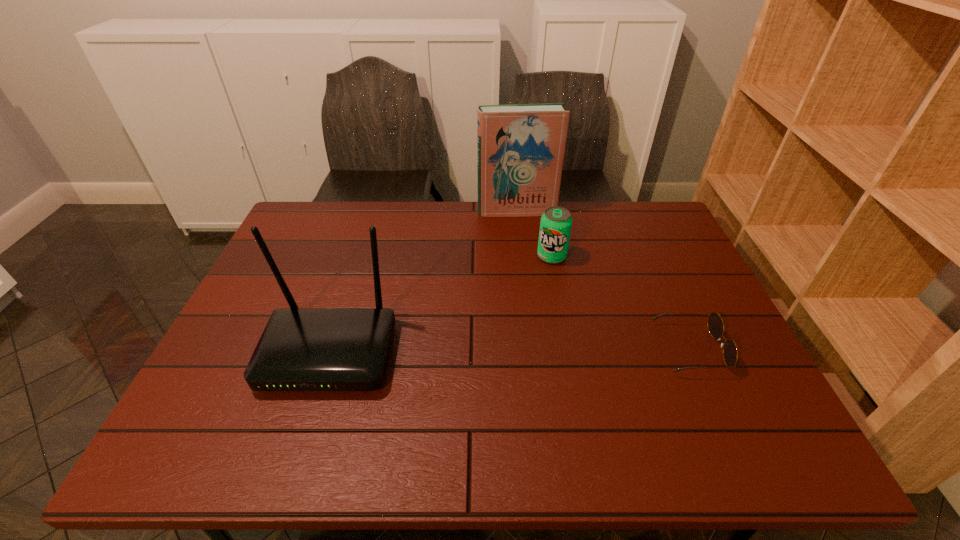
The image size is (960, 540). Identify the location of vacant space located 0.390m on the cover of the farthest object. (536, 298).

At what (x,y) coordinates should I click in order to perform the action: click on vacant area situated 0.320m on the front-facing side of the second shortest object. Please return your answer as a coordinate pair (x, y). The height and width of the screenshot is (540, 960). Looking at the image, I should click on (545, 350).

Identify the location of free space located on the front-facing side of the second shortest object. Image resolution: width=960 pixels, height=540 pixels. (546, 332).

I want to click on free space located 0.180m on the front-facing side of the second shortest object, so click(548, 309).

This screenshot has height=540, width=960. Identify the location of object that is at the far edge. (520, 147).

Image resolution: width=960 pixels, height=540 pixels. Find the location of `object situated at the near edge`. object situated at the near edge is located at coordinates (301, 349).

What are the coordinates of `object located at the left edge` in the screenshot? It's located at (301, 349).

Where is `object situated at the right edge`? This screenshot has height=540, width=960. object situated at the right edge is located at coordinates (715, 324).

Locate an element on the screen. This screenshot has width=960, height=540. object present at the near left corner is located at coordinates (301, 349).

Identify the location of vacant space at the far edge. (457, 209).